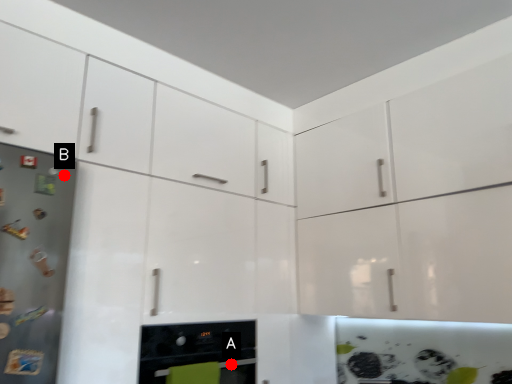
Question: Two points are circled on the image, labeled by A and B beside each circle. Which of the following is the farthest from the observer?

Choices:
 (A) A is further
 (B) B is further

Answer: (A)